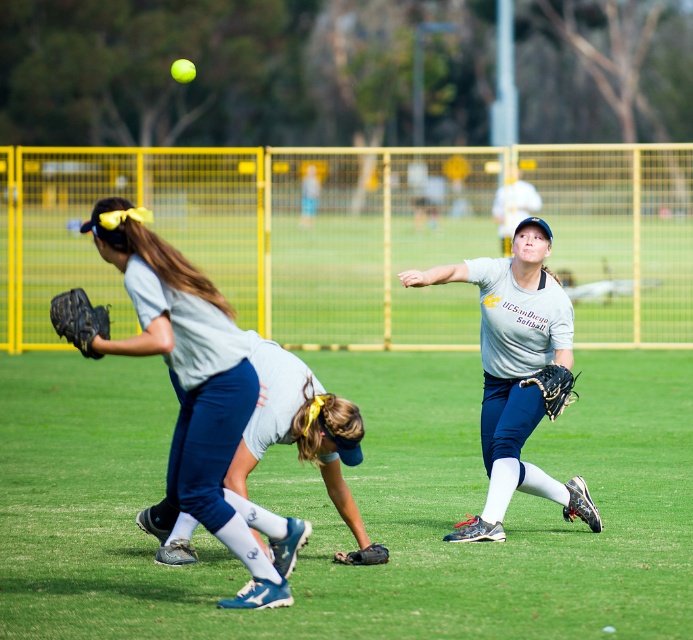
Question: Can you confirm if matte blue pants at center is wider than yellow matte baseball at upper center?

Choices:
 (A) yes
 (B) no

Answer: (B)

Question: Observing the image, what is the correct spatial positioning of matte blue pants at center in reference to yellow matte baseball at upper center?

Choices:
 (A) above
 (B) below

Answer: (B)

Question: Does black leather glove at left come in front of black leather baseball glove at center?

Choices:
 (A) yes
 (B) no

Answer: (A)

Question: Which of these objects is positioned farthest from the black leather glove at lower center?

Choices:
 (A) light gray jersey at center
 (B) black leather baseball glove at center

Answer: (B)

Question: Which object is positioned closest to the light gray jersey at center?

Choices:
 (A) matte blue pants at center
 (B) matte gray shirt at center
 (C) black leather glove at lower center
 (D) yellow matte baseball at upper center

Answer: (A)

Question: Which point is farther from the camera taking this photo?

Choices:
 (A) (387, 557)
 (B) (78, 326)
 (C) (191, 401)

Answer: (A)